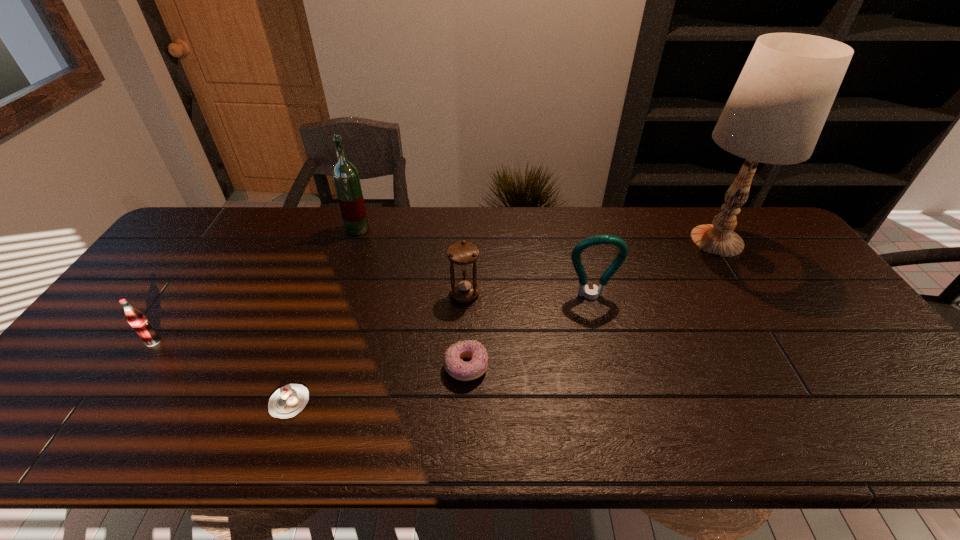
This screenshot has height=540, width=960. In order to click on object positioned at the left edge in this screenshot , I will do pos(137,320).

I want to click on object situated at the right edge, so click(775, 114).

Identify the location of object at the far right corner. The height and width of the screenshot is (540, 960). (775, 114).

Find the location of a particular element. The height and width of the screenshot is (540, 960). blank space at the far edge is located at coordinates (484, 231).

The height and width of the screenshot is (540, 960). I want to click on vacant region at the near edge of the desktop, so click(x=732, y=437).

This screenshot has width=960, height=540. Identify the location of free space at the left edge. (179, 256).

I want to click on vacant space at the right edge of the desktop, so tap(820, 357).

Find the location of a particular element. vacant area at the far right corner is located at coordinates (754, 221).

Where is `free space between the bottle opener and the hourglass`? This screenshot has height=540, width=960. free space between the bottle opener and the hourglass is located at coordinates (528, 295).

Locate an element on the screen. The height and width of the screenshot is (540, 960). free spot between the shortest object and the second object from right to left is located at coordinates (441, 349).